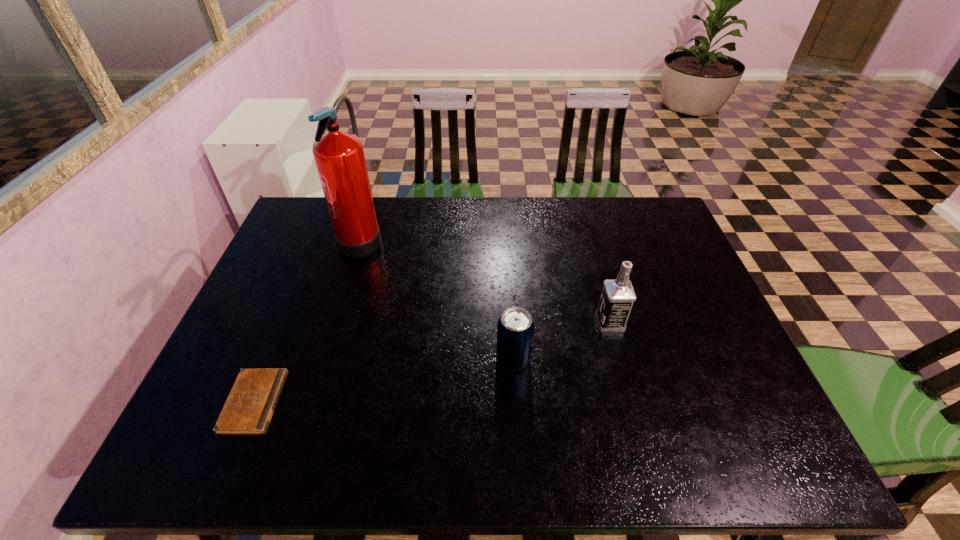
You are a GUI agent. You are given a task and a screenshot of the screen. Output one action in this format:
    pyautogui.click(x=<x>, y=<y>)
    Task: Click on the vacant space located 0.390m on the front label of the second tallest object
    The width and height of the screenshot is (960, 540).
    Given the screenshot: What is the action you would take?
    pyautogui.click(x=449, y=322)

At what (x,y) coordinates should I click in order to perform the action: click on blank space located on the front label of the second tallest object. Please return your answer as a coordinate pair (x, y). This screenshot has height=540, width=960. Looking at the image, I should click on (570, 322).

Where is `vacant space located on the back of the second object from right to left`? vacant space located on the back of the second object from right to left is located at coordinates (507, 258).

You are a GUI agent. You are given a task and a screenshot of the screen. Output one action in this format:
    pyautogui.click(x=<x>, y=<y>)
    Task: Click on the free space located on the spine side of the diary
    The height and width of the screenshot is (540, 960).
    Given the screenshot: What is the action you would take?
    pyautogui.click(x=314, y=402)

The height and width of the screenshot is (540, 960). In order to click on object situated at the far edge in this screenshot , I will do `click(339, 156)`.

You are a GUI agent. You are given a task and a screenshot of the screen. Output one action in this format:
    pyautogui.click(x=<x>, y=<y>)
    Task: Click on the object present at the near edge
    The width and height of the screenshot is (960, 540).
    Given the screenshot: What is the action you would take?
    (x=248, y=410)

The image size is (960, 540). I want to click on object present at the left edge, so click(248, 410).

The image size is (960, 540). Identify the location of object at the near left corner. (248, 410).

In the image, there is a desktop. Identify the location of vacant space at the far edge. This screenshot has height=540, width=960. (508, 224).

At what (x,y) coordinates should I click in order to perform the action: click on free region at the near edge of the desktop. Please return your answer as a coordinate pair (x, y). This screenshot has width=960, height=540. Looking at the image, I should click on (408, 428).